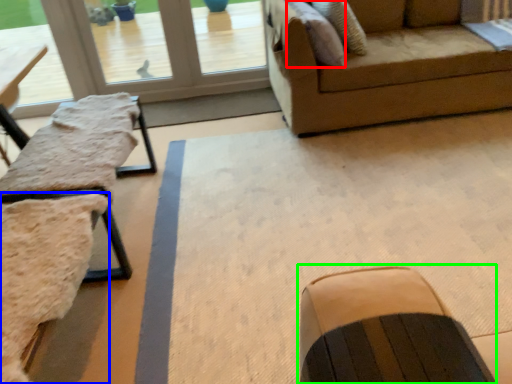
Question: Which object is positioned closest to pillow (highlighted by a red box)? Select from swivel chair (highlighted by a blue box) and rocking chair (highlighted by a green box).

Choices:
 (A) swivel chair
 (B) rocking chair

Answer: (A)